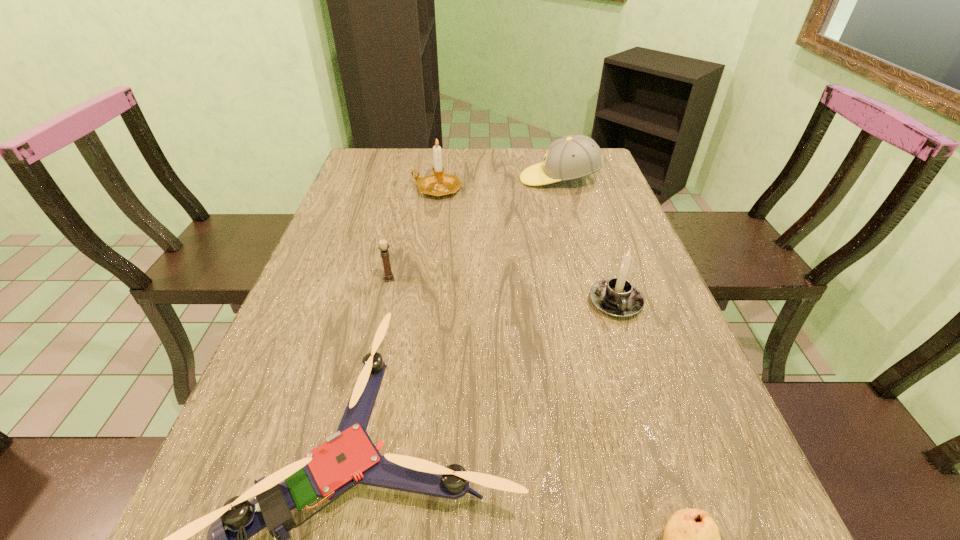
The height and width of the screenshot is (540, 960). In order to click on the farthest candle holder in this screenshot , I will do `click(439, 184)`.

Where is `the third nearest object`? The width and height of the screenshot is (960, 540). the third nearest object is located at coordinates (617, 297).

You are a GUI agent. You are given a task and a screenshot of the screen. Output one action in this format:
    pyautogui.click(x=<x>, y=<y>)
    Task: Click on the rightmost candle holder
    The width and height of the screenshot is (960, 540).
    Given the screenshot: What is the action you would take?
    pyautogui.click(x=617, y=297)

This screenshot has height=540, width=960. What are the coordinates of `baseball cap` in the screenshot? It's located at (571, 157).

This screenshot has height=540, width=960. What are the coordinates of `the third shortest object` in the screenshot? It's located at (383, 247).

Image resolution: width=960 pixels, height=540 pixels. Find the location of `the second farthest candle holder`. the second farthest candle holder is located at coordinates (383, 247).

Locate an element on the screen. This screenshot has height=540, width=960. free space located 0.060m on the front of the farthest candle holder is located at coordinates (434, 213).

Identify the location of vacant area located with a handle on the side of the nearest candle holder. Image resolution: width=960 pixels, height=540 pixels. coord(636,367).

The width and height of the screenshot is (960, 540). I want to click on vacant space situated 0.130m on the front-facing side of the baseball cap, so click(x=480, y=179).

Locate an element on the screen. The image size is (960, 540). free space located 0.350m on the front-facing side of the baseball cap is located at coordinates (412, 179).